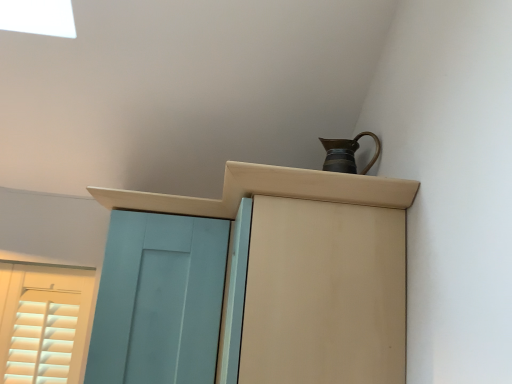
Measure the distance between point (178, 343) and camera.

Point (178, 343) and camera are 3.28 feet apart.

This screenshot has height=384, width=512. What do you see at coordinates (346, 154) in the screenshot? I see `metallic brown jug at upper right` at bounding box center [346, 154].

The image size is (512, 384). Identify the location of teal matte door at left. (159, 300).

Is the position of matte brown cupboard at upper right less distant than that of matte wood cabinet at upper center?

Yes, it is.

Considering the sizes of matte brown cupboard at upper right and matte wood cabinet at upper center in the image, is matte brown cupboard at upper right taller or shorter than matte wood cabinet at upper center?

matte brown cupboard at upper right is taller than matte wood cabinet at upper center.

The width and height of the screenshot is (512, 384). I want to click on screen door on the right of matte brown cupboard at upper right, so click(x=324, y=294).

Are matte wood cabinet at upper center and teal matte door at left beside each other?

No, matte wood cabinet at upper center is not making contact with teal matte door at left.

Can you tell me how much matte wood cabinet at upper center and teal matte door at left differ in facing direction?

They differ by 88.6 degrees in their facing directions.

From a real-world perspective, does matte wood cabinet at upper center stand above teal matte door at left?

Yes, from a real-world perspective, matte wood cabinet at upper center is on top of teal matte door at left.

Based on the photo, based on their positions, is matte wood cabinet at upper center located to the left or right of teal matte door at left?

matte wood cabinet at upper center is positioned on teal matte door at left's right side.

Considering the points (158, 350) and (258, 195), which point is behind, point (158, 350) or point (258, 195)?

Positioned behind is point (158, 350).

Is there a large distance between teal matte door at left and matte wood cabinet at upper center?

No.

Can you confirm if teal matte door at left is smaller than matte wood cabinet at upper center?

Yes.

From the picture: Does teal matte door at left appear on the right side of matte wood cabinet at upper center?

Incorrect, teal matte door at left is not on the right side of matte wood cabinet at upper center.

Is point (325, 333) positioned behind point (338, 338)?

No, it is not.

Are matte wood cabinet at upper center and matte brown cupboard at upper right beside each other?

Indeed, matte wood cabinet at upper center and matte brown cupboard at upper right are beside each other and touching.

Does matte wood cabinet at upper center have a smaller size compared to matte brown cupboard at upper right?

Yes.

How different are the orientations of matte wood cabinet at upper center and matte brown cupboard at upper right in degrees?

The facing directions of matte wood cabinet at upper center and matte brown cupboard at upper right are 8.21e-05 degrees apart.

Considering the sizes of objects teal matte door at left and matte brown cupboard at upper right in the image provided, who is thinner, teal matte door at left or matte brown cupboard at upper right?

With smaller width is teal matte door at left.

Which object is further away from the camera taking this photo, teal matte door at left or matte brown cupboard at upper right?

teal matte door at left is further away from the camera.

From a real-world perspective, does teal matte door at left stand above matte brown cupboard at upper right?

Incorrect, from a real-world perspective, teal matte door at left is lower than matte brown cupboard at upper right.

Considering the sizes of teal matte door at left and matte brown cupboard at upper right in the image, is teal matte door at left bigger or smaller than matte brown cupboard at upper right?

teal matte door at left is smaller than matte brown cupboard at upper right.

You are a GUI agent. You are given a task and a screenshot of the screen. Output one action in this format:
    pyautogui.click(x=<x>, y=<y>)
    Task: Click on the cupboard above the teal matte door at left (from the image's perspective)
    The image size is (512, 384).
    Given the screenshot: What is the action you would take?
    pyautogui.click(x=310, y=268)

Would you say matte brown cupboard at upper right is a long distance from teal matte door at left?

Actually, matte brown cupboard at upper right and teal matte door at left are a little close together.

Is matte brown cupboard at upper right in front of teal matte door at left?

Yes, the depth of matte brown cupboard at upper right is less than that of teal matte door at left.

Is matte brown cupboard at upper right wider than teal matte door at left?

Correct, the width of matte brown cupboard at upper right exceeds that of teal matte door at left.

From the image's perspective, is metallic brown jug at upper right over teal matte door at left?

Yes, from the image's perspective, metallic brown jug at upper right is on top of teal matte door at left.

Is metallic brown jug at upper right to the left of teal matte door at left from the viewer's perspective?

No.

Is point (349, 161) closer or farther from the camera than point (119, 283)?

Point (349, 161) is farther from the camera than point (119, 283).

Are metallic brown jug at upper right and teal matte door at left far apart?

Actually, metallic brown jug at upper right and teal matte door at left are a little close together.

This screenshot has height=384, width=512. What are the coordinates of `screen door lying behind the matte brown cupboard at upper right` in the screenshot? It's located at (324, 294).

You are a GUI agent. You are given a task and a screenshot of the screen. Output one action in this format:
    pyautogui.click(x=<x>, y=<y>)
    Task: Click on the screen door on the right of teal matte door at left
    
    Given the screenshot: What is the action you would take?
    pyautogui.click(x=324, y=294)

Looking at the image, which one is located further to matte wood cabinet at upper center, teal matte door at left or metallic brown jug at upper right?

teal matte door at left lies further to matte wood cabinet at upper center than the other object.

From the image, which object appears to be nearer to matte brown cupboard at upper right, metallic brown jug at upper right or teal matte door at left?

metallic brown jug at upper right is closer to matte brown cupboard at upper right.

Considering their positions, is metallic brown jug at upper right positioned closer to matte brown cupboard at upper right than matte wood cabinet at upper center?

Among the two, matte wood cabinet at upper center is located nearer to matte brown cupboard at upper right.

Estimate the real-world distances between objects in this image. Which object is closer to matte wood cabinet at upper center, metallic brown jug at upper right or matte brown cupboard at upper right?

matte brown cupboard at upper right.

Estimate the real-world distances between objects in this image. Which object is closer to matte brown cupboard at upper right, matte wood cabinet at upper center or teal matte door at left?

matte wood cabinet at upper center lies closer to matte brown cupboard at upper right than the other object.

Looking at the image, which one is located further to metallic brown jug at upper right, matte brown cupboard at upper right or teal matte door at left?

Based on the image, teal matte door at left appears to be further to metallic brown jug at upper right.

From the image, which object appears to be nearer to teal matte door at left, metallic brown jug at upper right or matte brown cupboard at upper right?

matte brown cupboard at upper right lies closer to teal matte door at left than the other object.

Looking at the image, which one is located further to matte wood cabinet at upper center, teal matte door at left or matte brown cupboard at upper right?

teal matte door at left.

Where is `cupboard between teal matte door at left and metallic brown jug at upper right`? The height and width of the screenshot is (384, 512). cupboard between teal matte door at left and metallic brown jug at upper right is located at coordinates (310, 268).

Locate an element on the screen. Image resolution: width=512 pixels, height=384 pixels. screen door between matte brown cupboard at upper right and teal matte door at left from front to back is located at coordinates (x=324, y=294).

Locate an element on the screen. Image resolution: width=512 pixels, height=384 pixels. screen door between matte brown cupboard at upper right and metallic brown jug at upper right from front to back is located at coordinates (x=324, y=294).

Image resolution: width=512 pixels, height=384 pixels. In order to click on screen door situated between teal matte door at left and metallic brown jug at upper right from left to right in this screenshot , I will do `click(324, 294)`.